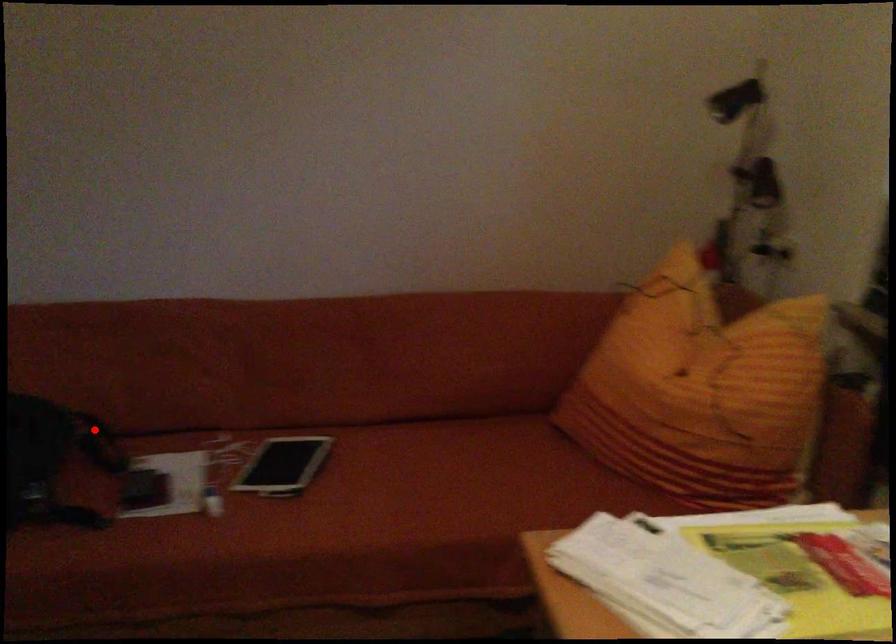
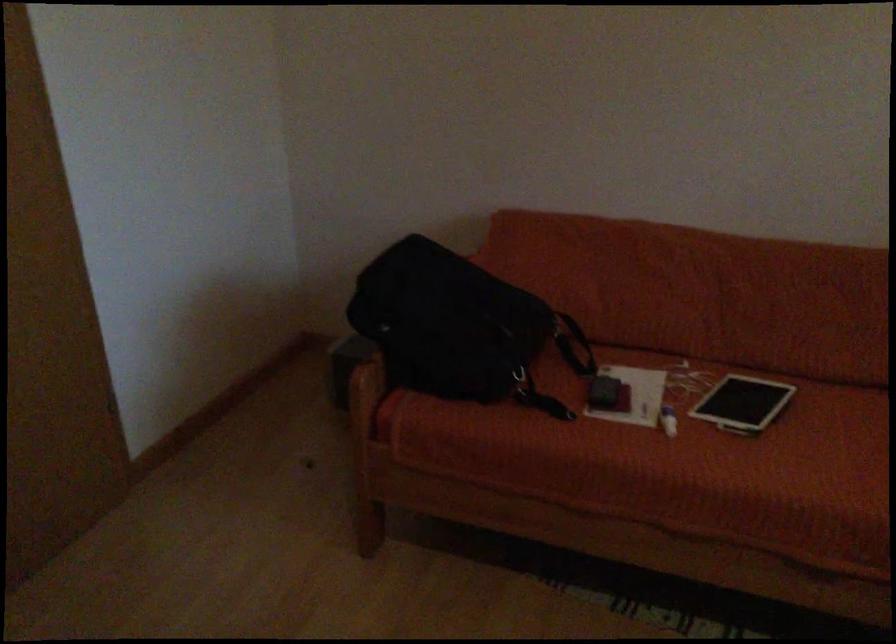
Question: I am providing you with two images of the same scene from different viewpoints. A red point is shown in image1. For the corresponding object point in image2, is it positioned nearer or farther from the camera?

Choices:
 (A) Nearer
 (B) Farther

Answer: (B)